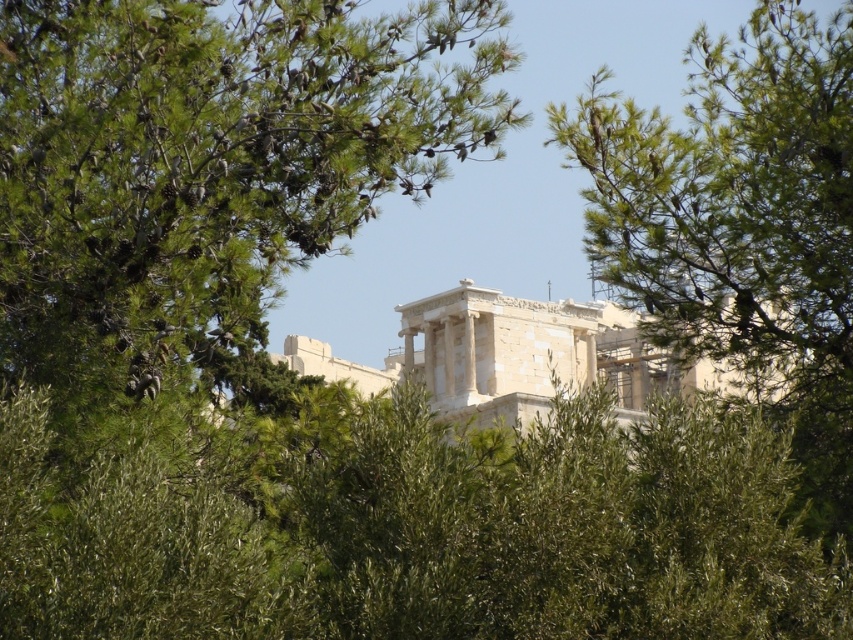
You are an archaeologist examining the Acropolis site. You notice the green pinecone at center and the green leafy tree at upper right. Which object is wider in the image?

The green pinecone at center might be wider than the green leafy tree at upper right according to the description.